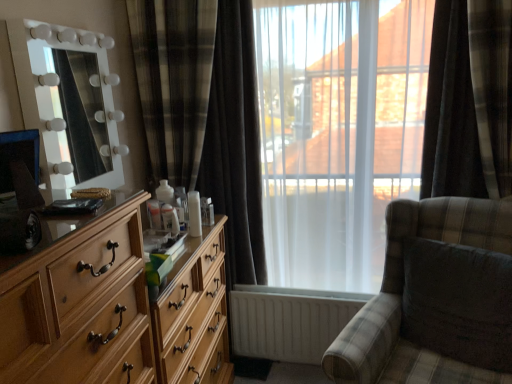
Question: Should I look upward or downward to see white glossy mirror at left?

Choices:
 (A) down
 (B) up

Answer: (B)

Question: From the image's perspective, is white glossy mirror at left located above plaid fabric rocking chair at center?

Choices:
 (A) yes
 (B) no

Answer: (A)

Question: Considering the relative positions of white glossy mirror at left and plaid fabric rocking chair at center in the image provided, is white glossy mirror at left in front of plaid fabric rocking chair at center?

Choices:
 (A) no
 (B) yes

Answer: (A)

Question: From the image's perspective, would you say white glossy mirror at left is shown under plaid fabric rocking chair at center?

Choices:
 (A) no
 (B) yes

Answer: (A)

Question: Can you confirm if white glossy mirror at left is shorter than plaid fabric rocking chair at center?

Choices:
 (A) yes
 (B) no

Answer: (A)

Question: Considering the relative sizes of white glossy mirror at left and plaid fabric rocking chair at center in the image provided, is white glossy mirror at left thinner than plaid fabric rocking chair at center?

Choices:
 (A) no
 (B) yes

Answer: (B)

Question: Can you confirm if white glossy mirror at left is wider than plaid fabric rocking chair at center?

Choices:
 (A) yes
 (B) no

Answer: (B)

Question: Does white glossy mirror at left have a larger size compared to dark plaid curtain at right, the first curtain viewed from the right?

Choices:
 (A) yes
 (B) no

Answer: (B)

Question: Is white glossy mirror at left placed right next to dark plaid curtain at right, the first curtain viewed from the right?

Choices:
 (A) no
 (B) yes

Answer: (A)

Question: From a real-world perspective, does white glossy mirror at left stand above dark plaid curtain at right, the first curtain viewed from the right?

Choices:
 (A) no
 (B) yes

Answer: (B)

Question: Would you consider white glossy mirror at left to be distant from dark plaid curtain at right, which ranks as the 2th curtain in left-to-right order?

Choices:
 (A) yes
 (B) no

Answer: (A)

Question: Considering the relative sizes of white glossy mirror at left and dark plaid curtain at right, the first curtain viewed from the right, in the image provided, is white glossy mirror at left shorter than dark plaid curtain at right, the first curtain viewed from the right,?

Choices:
 (A) no
 (B) yes

Answer: (B)

Question: Is white glossy mirror at left thinner than dark plaid curtain at right, which ranks as the 2th curtain in left-to-right order?

Choices:
 (A) no
 (B) yes

Answer: (B)

Question: Considering the relative sizes of light wood dresser at left and white glossy mirror at left in the image provided, is light wood dresser at left bigger than white glossy mirror at left?

Choices:
 (A) no
 (B) yes

Answer: (B)